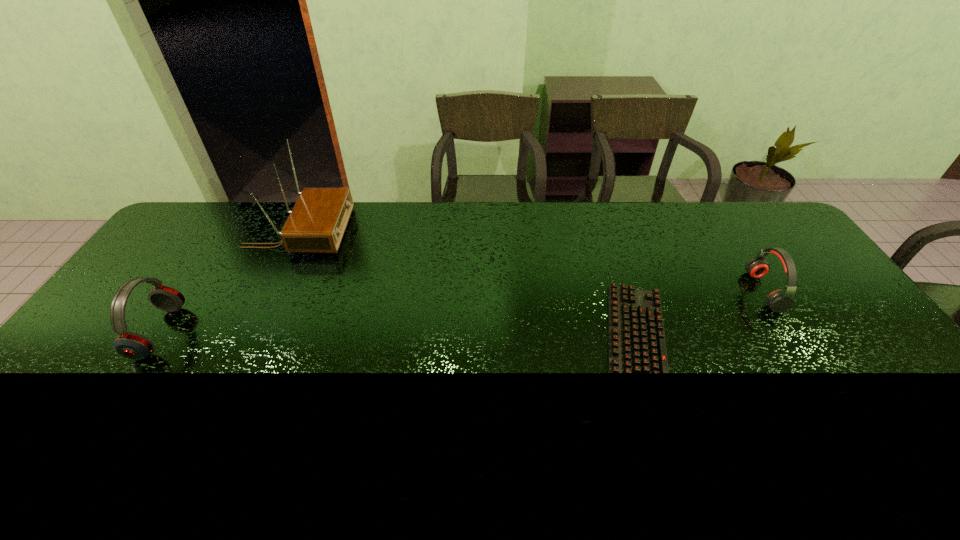
Find the location of a particular element. The height and width of the screenshot is (540, 960). free space located on the ear cups of the right earphone is located at coordinates (628, 291).

The height and width of the screenshot is (540, 960). I want to click on free space located on the ear cups of the right earphone, so (694, 291).

Identify the location of vacant space located 0.290m on the ear cups of the right earphone. This screenshot has width=960, height=540. (658, 291).

Where is `free space located 0.070m on the front of the computer keyboard`? free space located 0.070m on the front of the computer keyboard is located at coordinates (671, 454).

This screenshot has height=540, width=960. Identify the location of object that is positioned at the far edge. (317, 223).

Image resolution: width=960 pixels, height=540 pixels. I want to click on object located at the left edge, so click(131, 345).

Where is `vacant space at the far edge`? The width and height of the screenshot is (960, 540). vacant space at the far edge is located at coordinates (672, 202).

In the image, there is a desktop. Identify the location of vacant space at the near edge. (678, 437).

Where is `vacant space at the right edge`? vacant space at the right edge is located at coordinates (840, 338).

The height and width of the screenshot is (540, 960). Identify the location of free spot at the far left corner of the desktop. (203, 211).